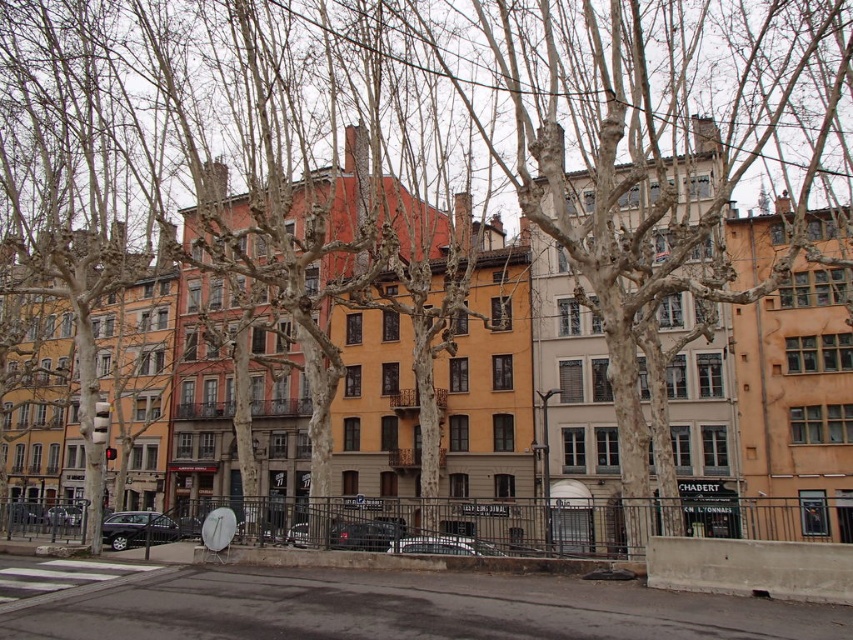
You are standing at the point marked by coordinates point (433, 545) which is the location of metallic silver car at center. You want to walk towards the nearest building facade. Which direction should you face?

The nearest building facade is to the north of the metallic silver car at center, so you should face north to walk towards it.